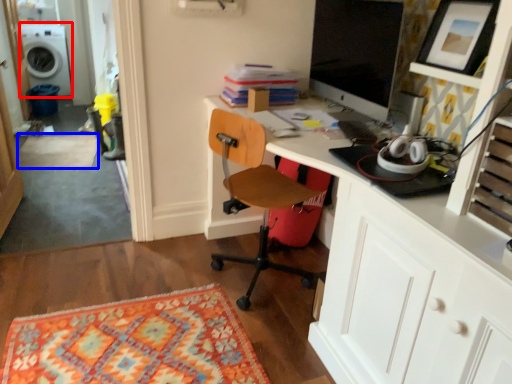
Question: Which object appears farthest to the camera in this image, washing machine (highlighted by a red box) or mat (highlighted by a blue box)?

Choices:
 (A) washing machine
 (B) mat

Answer: (A)